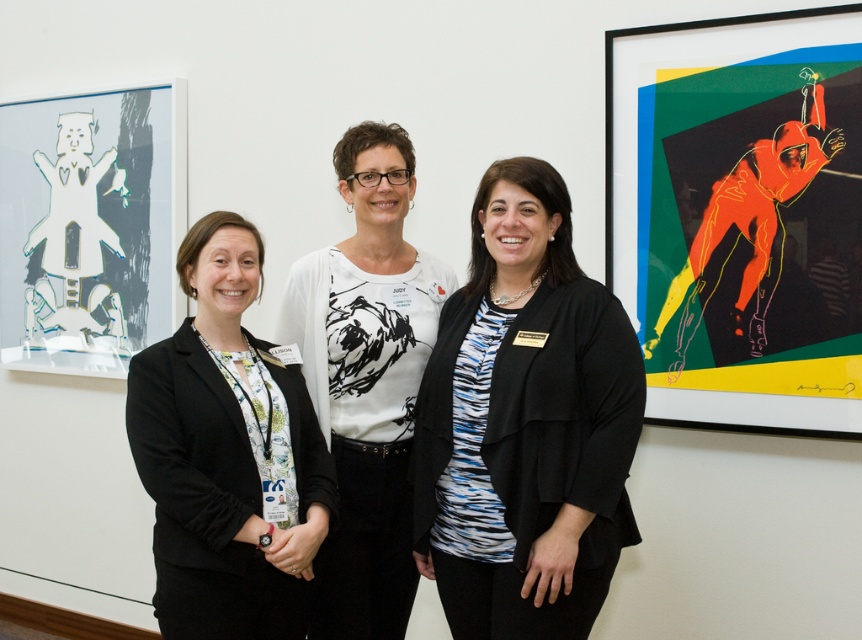
Question: Is black textured blazer at center behind black matte blazer at left?

Choices:
 (A) yes
 (B) no

Answer: (A)

Question: Which of the following is the closest to the observer?

Choices:
 (A) black matte blazer at left
 (B) black textured blazer at center

Answer: (A)

Question: From the image, what is the correct spatial relationship of black textured blazer at center in relation to black matte blazer at left?

Choices:
 (A) above
 (B) below

Answer: (A)

Question: Can you confirm if black textured blazer at center is wider than black matte blazer at left?

Choices:
 (A) yes
 (B) no

Answer: (A)